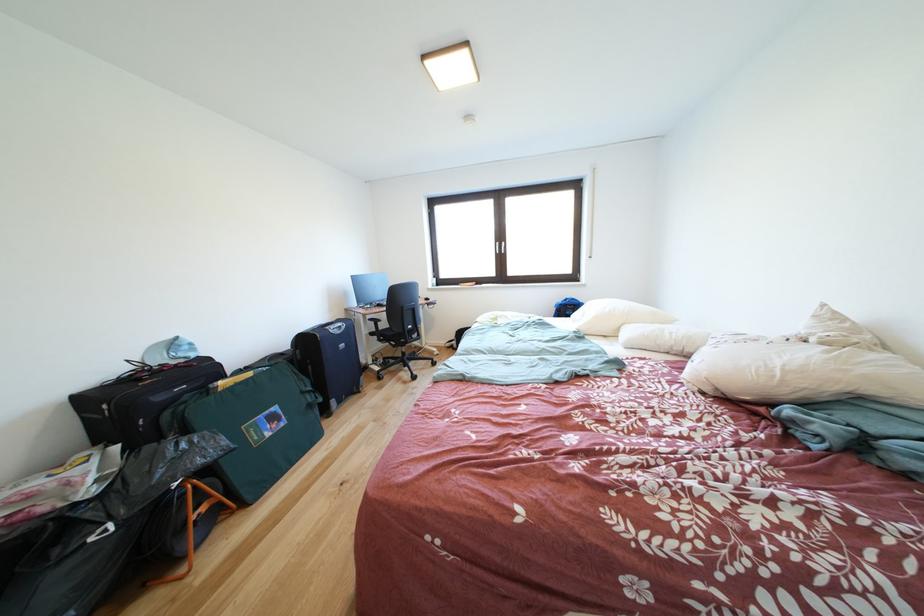
Find where to pull the suitcase handle. Please return your answer as a coordinate pair (x, y).

(329, 361)